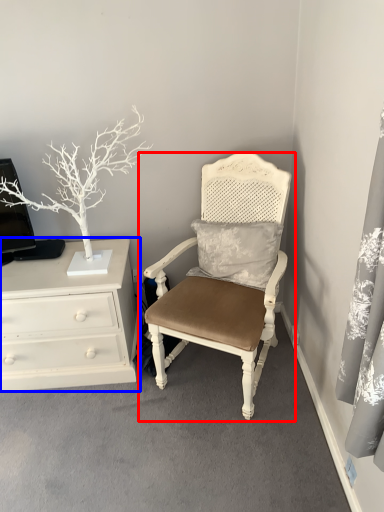
Question: Which object appears farthest to the camera in this image, chair (highlighted by a red box) or chest of drawers (highlighted by a blue box)?

Choices:
 (A) chair
 (B) chest of drawers

Answer: (B)